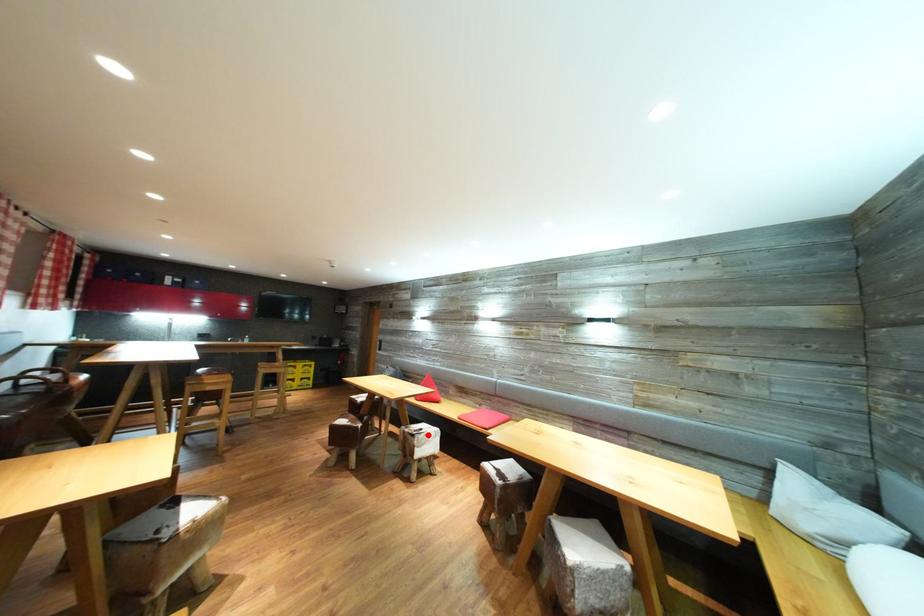
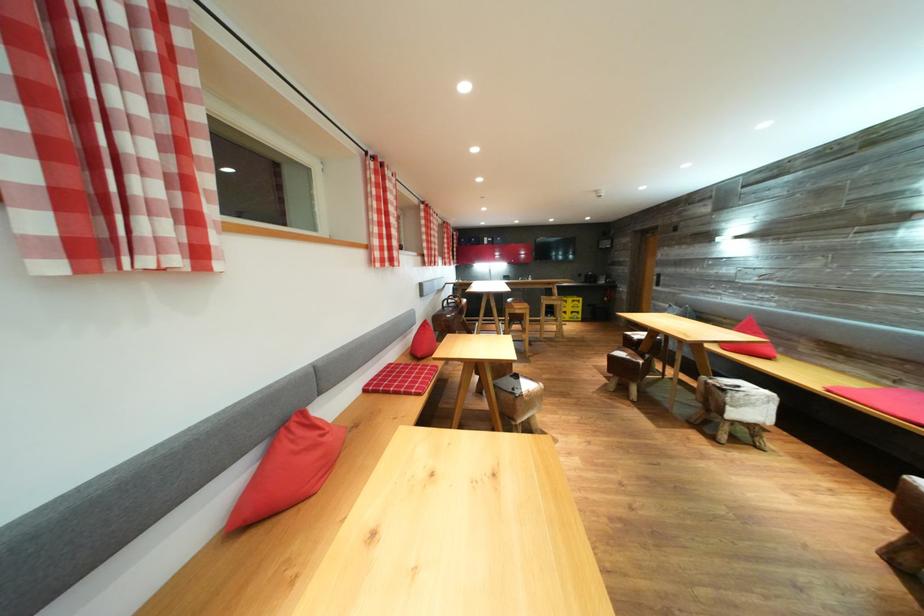
Find the pixel in the second image that matches the highlighted location in the first image.

(745, 392)